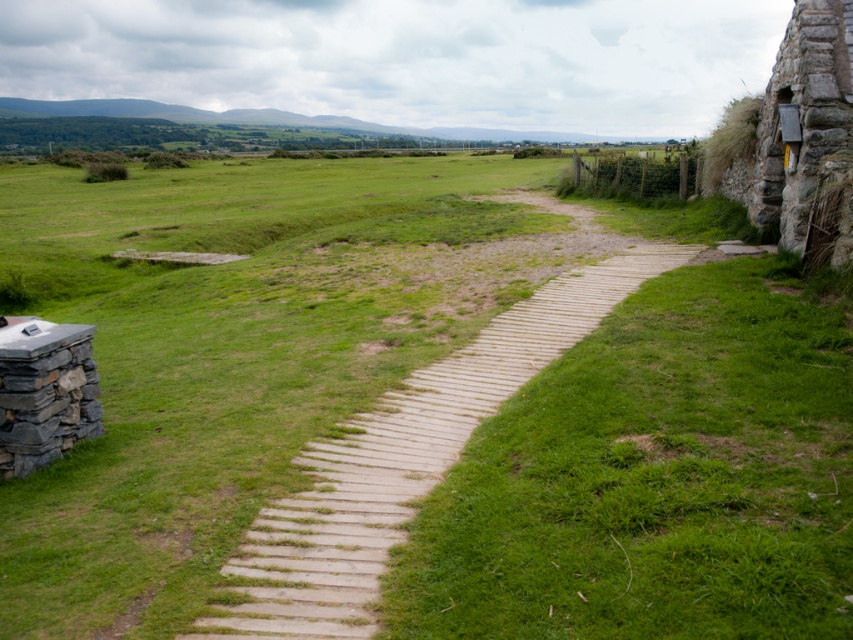
Between point (335, 531) and point (68, 376), which one is positioned behind?

Point (68, 376)

Is light brown wooden path at center further to camera compared to gray stone wall at lower left?

No, light brown wooden path at center is closer to the viewer.

This screenshot has height=640, width=853. Identify the location of light brown wooden path at center. (405, 460).

Which is below, green grassy at center or gray stone wall at lower left?

green grassy at center is lower down.

Where is `green grassy at center`? green grassy at center is located at coordinates (654, 477).

Who is higher up, green grassy at center or light brown wooden path at center?

light brown wooden path at center is above.

Can you confirm if green grassy at center is thinner than light brown wooden path at center?

Correct, green grassy at center's width is less than light brown wooden path at center's.

Which is in front, point (743, 428) or point (317, 452)?

Positioned in front is point (743, 428).

The width and height of the screenshot is (853, 640). I want to click on green grassy at center, so click(x=654, y=477).